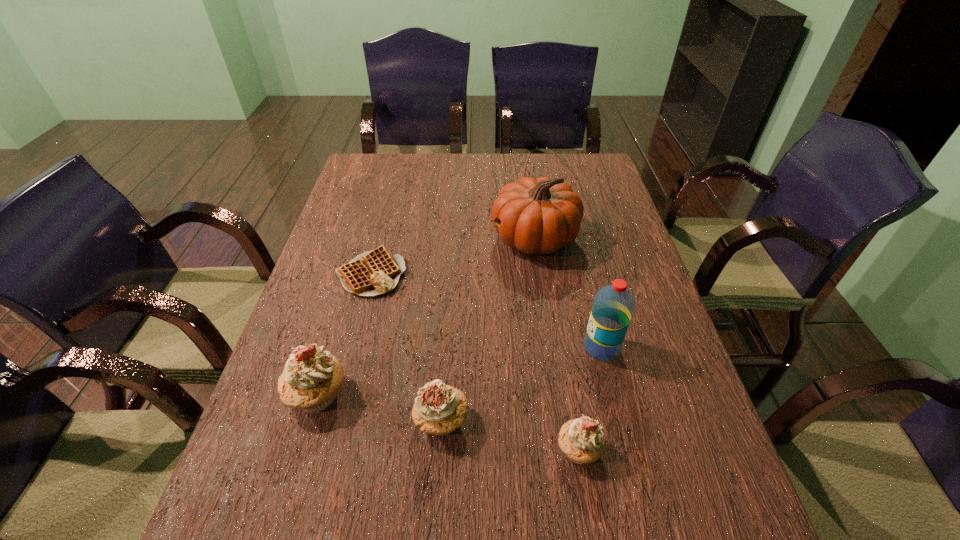
Find the location of `vacant region between the pumpkin and the rightmost cupcake`. vacant region between the pumpkin and the rightmost cupcake is located at coordinates (557, 344).

This screenshot has height=540, width=960. What are the coordinates of `free spot between the waffle and the fourth tallest object` in the screenshot? It's located at (406, 347).

Locate an element on the screen. vacant space that's between the rightmost cupcake and the fourth nearest object is located at coordinates (590, 399).

In order to click on free area in between the second cupcake from right to left and the third farthest object in this screenshot , I will do `click(521, 384)`.

Identify the location of vacant area that lies between the third object from left to right and the shortest cupcake. (510, 435).

The width and height of the screenshot is (960, 540). What are the coordinates of `vacant area that lies between the shortest cupcake and the fourth nearest object` in the screenshot? It's located at (590, 399).

The height and width of the screenshot is (540, 960). Find the location of `unoccupied area between the waffle and the water bottle`. unoccupied area between the waffle and the water bottle is located at coordinates (486, 310).

Where is `blank region between the fourth object from right to left and the water bottle`? The image size is (960, 540). blank region between the fourth object from right to left and the water bottle is located at coordinates (521, 384).

Locate an element on the screen. free space that is in between the pumpkin and the waffle is located at coordinates (453, 256).

Locate which object ranks third in proximity to the waffle. Please provide its 2D coordinates. Your answer should be formatted as a tuple, i.e. [(x, y)], where the tuple contains the x and y coordinates of a point satisfying the conditions above.

[(439, 409)]